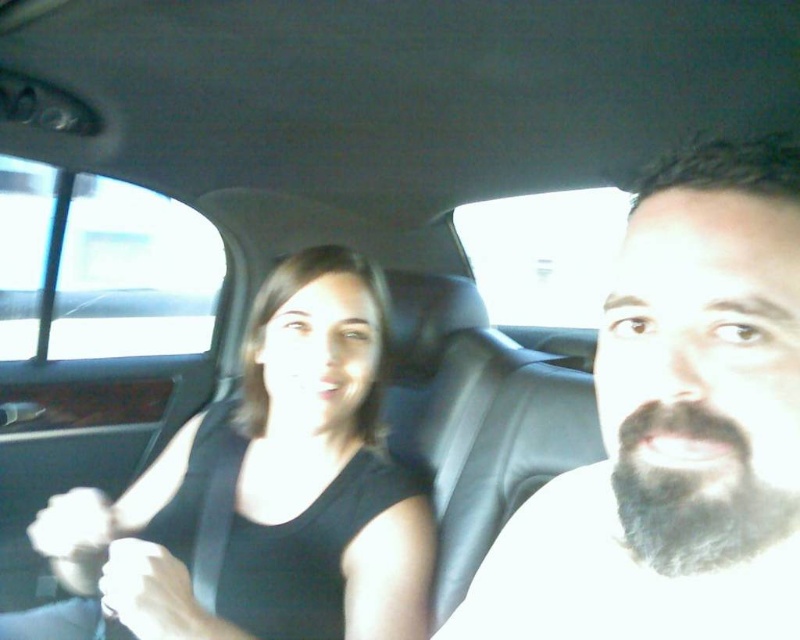
You are a photographer trying to capture a clear photo of the black fabric shirt at upper left and the matte black hand at center. Which object is closer to the camera?

The black fabric shirt at upper left is closer to the camera than the matte black hand at center because it is further to the viewer.

In the scene shown: You are a photographer trying to capture the best angle of the black fabric shirt at upper left and the white fabric hand at lower left in the car scene. Which object is positioned more to the right from the viewer perspective?

The black fabric shirt at upper left is positioned more to the right from the viewer perspective than the white fabric hand at lower left.

You are a photographer trying to capture a clear photo of the dark brown beard at right and the black fabric shirt at upper left. Based on their sizes in the image, which one would you focus on first to ensure it is in sharp focus?

The dark brown beard at right occupies less space than the black fabric shirt at upper left, so you should focus on the black fabric shirt at upper left first since it is larger and more prominent in the frame.